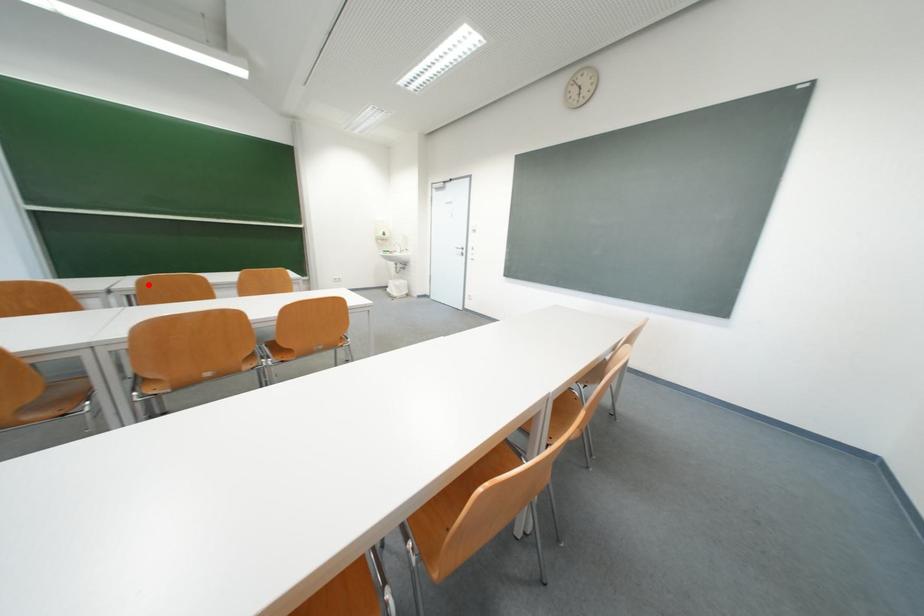
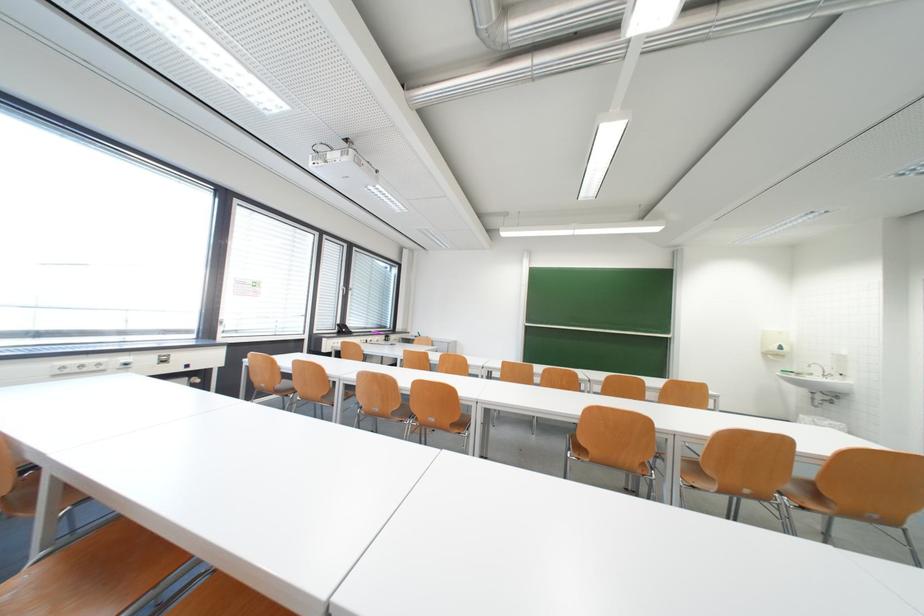
Locate, in the second image, the point that corresponds to the highlighted location in the first image.

(616, 379)